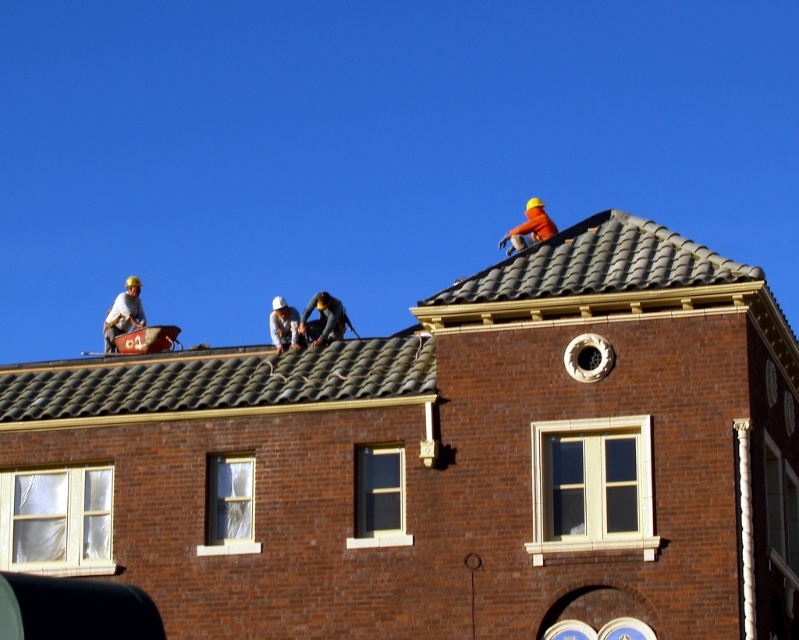
Between brown tile roof at upper center and dark gray fabric at center, which one is positioned lower?

brown tile roof at upper center

How far apart are brown tile roof at upper center and dark gray fabric at center?

They are 56.25 feet apart.

Who is more forward, [154,401] or [334,310]?

Point [154,401] is more forward.

Locate an element on the screen. The width and height of the screenshot is (799, 640). brown tile roof at upper center is located at coordinates (611, 282).

Can you confirm if dark gray fabric at center is positioned above white hard hat at center?

Yes, dark gray fabric at center is above white hard hat at center.

Is dark gray fabric at center in front of white hard hat at center?

That is True.

Is point (328, 320) positioned after point (281, 314)?

No.

Identify the location of dark gray fabric at center. (324, 320).

Where is `brown tile roof at upper center`? This screenshot has width=799, height=640. brown tile roof at upper center is located at coordinates (611, 282).

Is brown tile roof at upper center further to camera compared to matte black helmet at upper left?

No.

This screenshot has height=640, width=799. What do you see at coordinates (611, 282) in the screenshot? I see `brown tile roof at upper center` at bounding box center [611, 282].

Identify the location of brown tile roof at upper center. (611, 282).